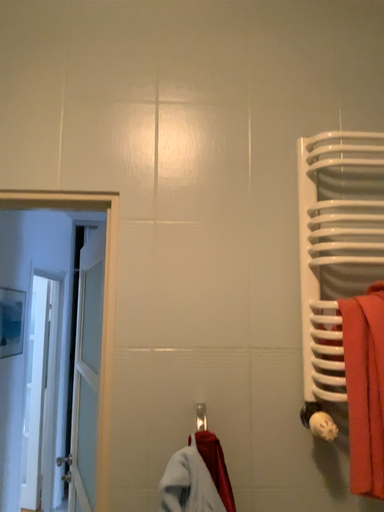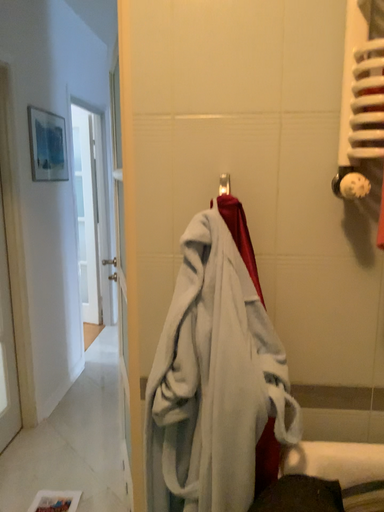
Question: How did the camera likely rotate when shooting the video?

Choices:
 (A) rotated left
 (B) rotated right

Answer: (A)